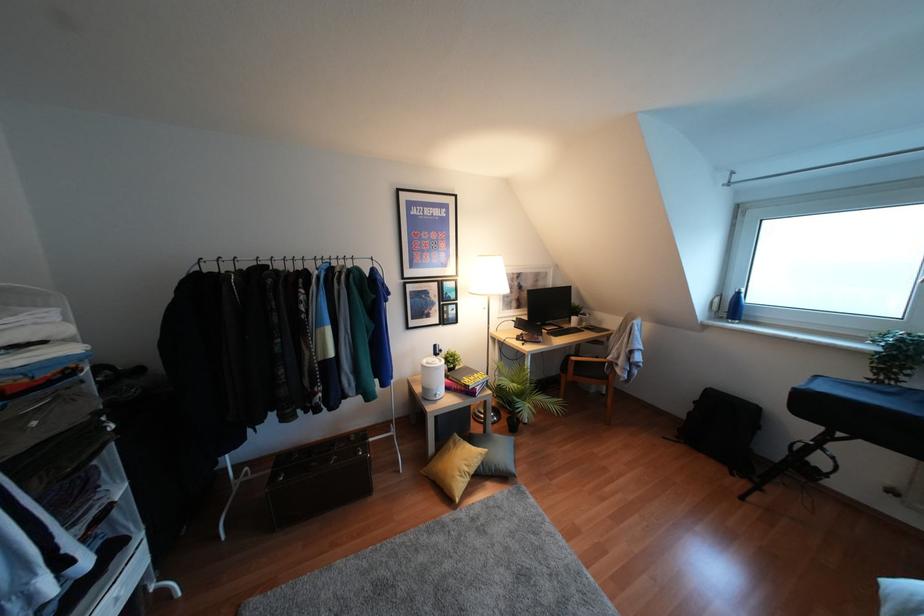
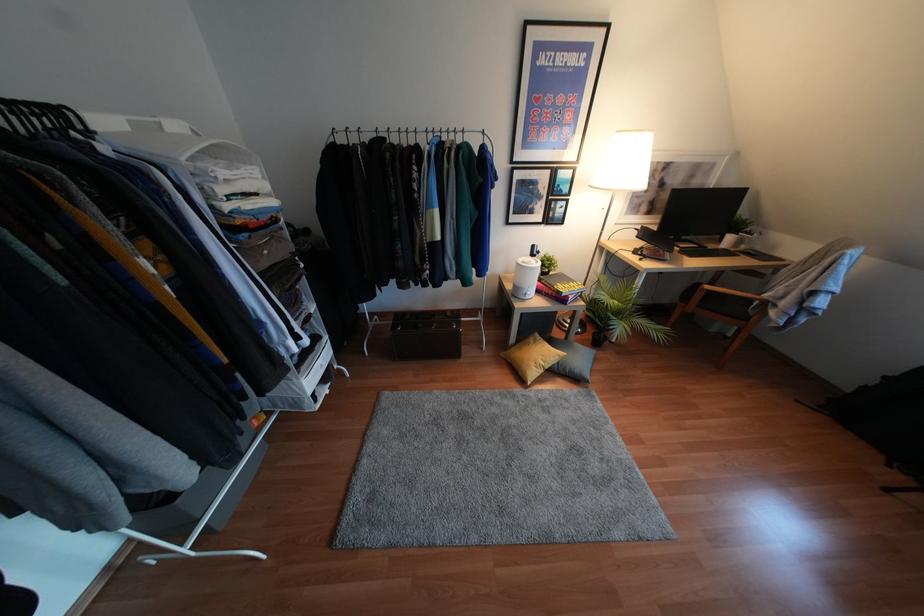
In the second image, find the point that corresponds to point (436, 397) in the first image.

(526, 297)